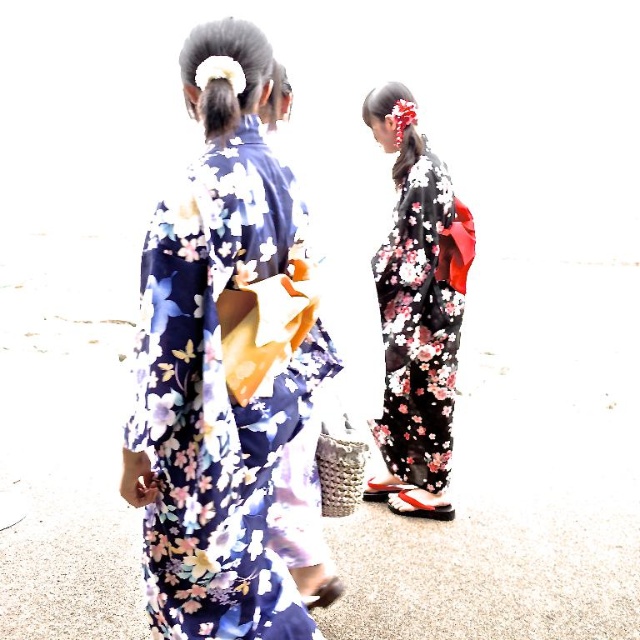
Question: Which point is closer to the camera?

Choices:
 (A) (371, 483)
 (B) (253, 264)

Answer: (B)

Question: Is floral silk kimono at center bigger than black floral kimono at center?

Choices:
 (A) no
 (B) yes

Answer: (B)

Question: Which object is closer to the camera taking this photo?

Choices:
 (A) black floral kimono at center
 (B) floral silk kimono at center

Answer: (B)

Question: Is floral silk kimono at center further to camera compared to black floral kimono at center?

Choices:
 (A) yes
 (B) no

Answer: (B)

Question: Can you confirm if floral silk kimono at center is thinner than black floral kimono at center?

Choices:
 (A) yes
 (B) no

Answer: (B)